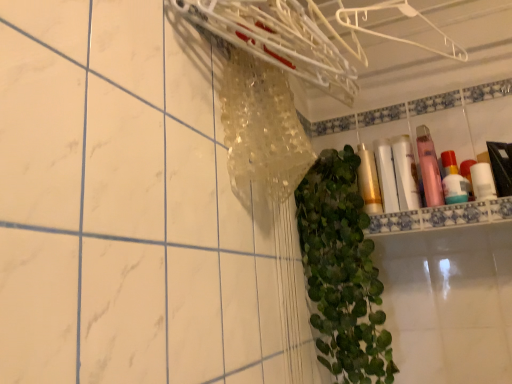
Image resolution: width=512 pixels, height=384 pixels. Describe the element at coordinates (442, 216) in the screenshot. I see `white glossy shelf at upper right` at that location.

Locate an element on the screen. The height and width of the screenshot is (384, 512). clear plastic hanger at upper center, which is the second hanger from right to left is located at coordinates (277, 39).

Find the location of a particular element. Image resolution: width=512 pixels, height=384 pixels. pink glossy lotion at upper right, acting as the third toiletry starting from the right is located at coordinates (429, 167).

Locate an element on the screen. green leafy plant at center is located at coordinates coord(342,271).

Measure the distance from white glossy tube at upper right, which is the third toiletry in left-to-right order, to pink glossy lotion at upper right, acting as the third toiletry starting from the right.

white glossy tube at upper right, which is the third toiletry in left-to-right order, and pink glossy lotion at upper right, acting as the third toiletry starting from the right, are 4.50 centimeters apart.

Who is bigger, white glossy tube at upper right, which is the third toiletry in left-to-right order, or pink glossy lotion at upper right, which appears as the 4th toiletry when viewed from the left?

pink glossy lotion at upper right, which appears as the 4th toiletry when viewed from the left.

Between white glossy tube at upper right, which is the third toiletry in left-to-right order, and pink glossy lotion at upper right, which appears as the 4th toiletry when viewed from the left, which one appears on the right side from the viewer's perspective?

Positioned to the right is pink glossy lotion at upper right, which appears as the 4th toiletry when viewed from the left.

From their relative heights in the image, would you say white glossy tube at upper right, which is the third toiletry in left-to-right order, is taller or shorter than pink glossy lotion at upper right, which appears as the 4th toiletry when viewed from the left?

Clearly, white glossy tube at upper right, which is the third toiletry in left-to-right order, is shorter compared to pink glossy lotion at upper right, which appears as the 4th toiletry when viewed from the left.

In the scene shown: Which is more to the right, white glossy lotion at upper right, placed as the sixth toiletry when sorted from left to right, or green leafy plant at center?

white glossy lotion at upper right, placed as the sixth toiletry when sorted from left to right.

Which toiletry is the 1st one when counting from the back of the green leafy plant at center? Please provide its 2D coordinates.

[(483, 182)]

Locate an element on the screen. the 5th toiletry to the right of the green leafy plant at center, counting from the anchor's position is located at coordinates (453, 180).

Which object is positioned more to the right, pink matte bottle at upper right, the 5th toiletry viewed from the left, or green leafy plant at center?

pink matte bottle at upper right, the 5th toiletry viewed from the left, is more to the right.

Considering the relative sizes of pink matte bottle at upper right, the 5th toiletry viewed from the left, and green leafy plant at center in the image provided, is pink matte bottle at upper right, the 5th toiletry viewed from the left, taller than green leafy plant at center?

In fact, pink matte bottle at upper right, the 5th toiletry viewed from the left, may be shorter than green leafy plant at center.

Between point (414, 203) and point (372, 152), which one is positioned in front?

The point (414, 203) is closer to the camera.

Based on the photo, from a real-world perspective, which object stands above the other?

white glossy tube at upper right, which is the third toiletry in left-to-right order, from a real-world perspective.

Is matte white tube at right, the 5th toiletry from the right, not close to pink glossy lotion at upper right, acting as the third toiletry starting from the right?

matte white tube at right, the 5th toiletry from the right, is actually quite close to pink glossy lotion at upper right, acting as the third toiletry starting from the right.

Starting from the pink glossy lotion at upper right, which appears as the 4th toiletry when viewed from the left, which toiletry is the 2nd one behind? Please provide its 2D coordinates.

[(386, 176)]

Looking at this image, does matte white tube at right, the 5th toiletry from the right, have a lesser height compared to pink glossy lotion at upper right, acting as the third toiletry starting from the right?

Correct, matte white tube at right, the 5th toiletry from the right, is not as tall as pink glossy lotion at upper right, acting as the third toiletry starting from the right.

Is pink glossy lotion at upper right, which appears as the 4th toiletry when viewed from the left, located within matte white tube at right, the 5th toiletry from the right?

No, matte white tube at right, the 5th toiletry from the right, does not contain pink glossy lotion at upper right, which appears as the 4th toiletry when viewed from the left.

Can you confirm if white glossy tube at upper right, acting as the fourth toiletry starting from the right, is taller than pink matte bottle at upper right, which appears as the second toiletry when viewed from the right?

Yes.

Find the location of `toiletry that is the 3rd one when counting forward from the pink matte bottle at upper right, the 5th toiletry viewed from the left`. toiletry that is the 3rd one when counting forward from the pink matte bottle at upper right, the 5th toiletry viewed from the left is located at coordinates (405, 173).

Considering the positions of point (405, 194) and point (461, 193), is point (405, 194) closer or farther from the camera than point (461, 193)?

Point (405, 194) appears to be farther away from the viewer than point (461, 193).

Considering the positions of objects white glossy tube at upper right, acting as the fourth toiletry starting from the right, and pink matte bottle at upper right, which appears as the second toiletry when viewed from the right, in the image provided, who is behind, white glossy tube at upper right, acting as the fourth toiletry starting from the right, or pink matte bottle at upper right, which appears as the second toiletry when viewed from the right,?

pink matte bottle at upper right, which appears as the second toiletry when viewed from the right.

Could white glossy shelf at upper right be considered to be inside gold metallic lotion at center, acting as the 6th toiletry starting from the right?

No, gold metallic lotion at center, acting as the 6th toiletry starting from the right, does not contain white glossy shelf at upper right.

Could you tell me if gold metallic lotion at center, which is counted as the 1th toiletry, starting from the left, is facing white glossy shelf at upper right?

No, gold metallic lotion at center, which is counted as the 1th toiletry, starting from the left, does not turn towards white glossy shelf at upper right.

How many degrees apart are the facing directions of gold metallic lotion at center, acting as the 6th toiletry starting from the right, and white glossy shelf at upper right?

The facing directions of gold metallic lotion at center, acting as the 6th toiletry starting from the right, and white glossy shelf at upper right are 2.9 degrees apart.

From a real-world perspective, who is located lower, gold metallic lotion at center, acting as the 6th toiletry starting from the right, or white glossy shelf at upper right?

From a 3D spatial view, white glossy shelf at upper right is below.

Locate an element on the screen. The height and width of the screenshot is (384, 512). toiletry that is the 1st one when counting downward from the pink glossy lotion at upper right, acting as the third toiletry starting from the right (from the image's perspective) is located at coordinates (405, 173).

This screenshot has width=512, height=384. Identify the location of houseplant that is on the left side of white glossy lotion at upper right, placed as the 1th toiletry when sorted from right to left. (342, 271).

When comparing their distances from white glossy shelf at upper right, does pink glossy lotion at upper right, acting as the third toiletry starting from the right, or matte white tube at right, marked as the second toiletry in a left-to-right arrangement, seem further?

Based on the image, matte white tube at right, marked as the second toiletry in a left-to-right arrangement, appears to be further to white glossy shelf at upper right.

Based on their spatial positions, is white glossy shelf at upper right or white glossy tube at upper right, which is the third toiletry in left-to-right order, closer to clear plastic hanger at upper center, the 1th hanger when ordered from left to right?

white glossy tube at upper right, which is the third toiletry in left-to-right order.

When comparing their distances from white glossy shelf at upper right, does green leafy plant at center or white plastic hanger at upper center, the first hanger positioned from the right, seem further?

Based on the image, white plastic hanger at upper center, the first hanger positioned from the right, appears to be further to white glossy shelf at upper right.

Considering their positions, is pink glossy lotion at upper right, which appears as the 4th toiletry when viewed from the left, positioned further to matte white tube at right, marked as the second toiletry in a left-to-right arrangement, than gold metallic lotion at center, acting as the 6th toiletry starting from the right?

pink glossy lotion at upper right, which appears as the 4th toiletry when viewed from the left, is positioned further to the anchor matte white tube at right, marked as the second toiletry in a left-to-right arrangement.

Considering their positions, is pink glossy lotion at upper right, which appears as the 4th toiletry when viewed from the left, positioned further to gold metallic lotion at center, which is counted as the 1th toiletry, starting from the left, than white plastic hanger at upper center, the first hanger positioned from the right?

The object further to gold metallic lotion at center, which is counted as the 1th toiletry, starting from the left, is white plastic hanger at upper center, the first hanger positioned from the right.

From the image, which object appears to be farther from pink glossy lotion at upper right, acting as the third toiletry starting from the right, white glossy shelf at upper right or white glossy tube at upper right, acting as the fourth toiletry starting from the right?

The object further to pink glossy lotion at upper right, acting as the third toiletry starting from the right, is white glossy shelf at upper right.

Which object lies further to the anchor point white glossy tube at upper right, acting as the fourth toiletry starting from the right, matte white tube at right, marked as the second toiletry in a left-to-right arrangement, or gold metallic lotion at center, acting as the 6th toiletry starting from the right?

Based on the image, gold metallic lotion at center, acting as the 6th toiletry starting from the right, appears to be further to white glossy tube at upper right, acting as the fourth toiletry starting from the right.

Based on their spatial positions, is pink matte bottle at upper right, the 5th toiletry viewed from the left, or green leafy plant at center closer to pink glossy lotion at upper right, acting as the third toiletry starting from the right?

pink matte bottle at upper right, the 5th toiletry viewed from the left, is closer to pink glossy lotion at upper right, acting as the third toiletry starting from the right.

What are the coordinates of `ledge between green leafy plant at center and pink matte bottle at upper right, the 5th toiletry viewed from the left, in the horizontal direction` in the screenshot? It's located at (442, 216).

At what (x,y) coordinates should I click in order to perform the action: click on toiletry between matte white tube at right, the 5th toiletry from the right, and pink glossy lotion at upper right, acting as the third toiletry starting from the right, in the horizontal direction. Please return your answer as a coordinate pair (x, y). This screenshot has height=384, width=512. Looking at the image, I should click on (405, 173).

Image resolution: width=512 pixels, height=384 pixels. Identify the location of ledge between matte white tube at right, the 5th toiletry from the right, and white glossy lotion at upper right, placed as the 1th toiletry when sorted from right to left, from left to right. (442, 216).

Image resolution: width=512 pixels, height=384 pixels. Find the location of `toiletry between white glossy tube at upper right, which is the third toiletry in left-to-right order, and pink matte bottle at upper right, the 5th toiletry viewed from the left`. toiletry between white glossy tube at upper right, which is the third toiletry in left-to-right order, and pink matte bottle at upper right, the 5th toiletry viewed from the left is located at coordinates (429, 167).